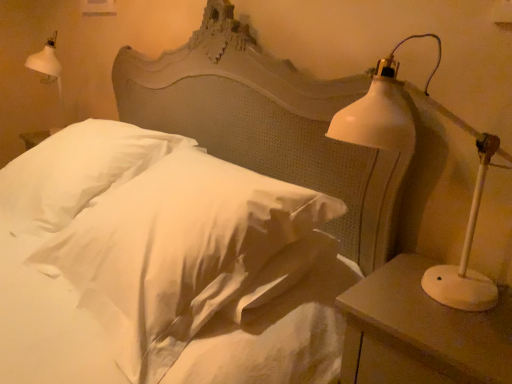
Where is `free spot above white matte nightstand at right (from a real-world perspective)`? free spot above white matte nightstand at right (from a real-world perspective) is located at coordinates (446, 307).